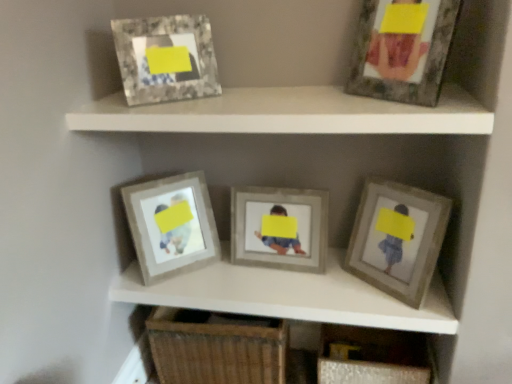
Question: From a real-world perspective, is matte gray frame at center right, the 1th picture frame positioned from the right, above or below woven wood drawer at lower center?

Choices:
 (A) below
 (B) above

Answer: (B)

Question: From the image's perspective, relative to woven wood drawer at lower center, is matte gray frame at center right, which appears as the fifth picture frame when viewed from the left, above or below?

Choices:
 (A) below
 (B) above

Answer: (B)

Question: Which of these objects is positioned closest to the matte gray frame at center?

Choices:
 (A) wooden frame at center, positioned as the first picture frame in left-to-right order
 (B) woven wood drawer at lower center
 (C) matte gray frame at upper right, which ranks as the 2th picture frame in right-to-left order
 (D) wooden frame at center, which ranks as the third picture frame in right-to-left order
 (E) matte gray frame at upper center

Answer: (D)

Question: Which object is positioned closest to the matte gray frame at center right, which appears as the fifth picture frame when viewed from the left?

Choices:
 (A) matte gray frame at center
 (B) wooden frame at center, which is the 3th picture frame from left to right
 (C) matte gray frame at upper right, marked as the fourth picture frame in a left-to-right arrangement
 (D) matte gray frame at upper center
 (E) woven wood drawer at lower center

Answer: (A)